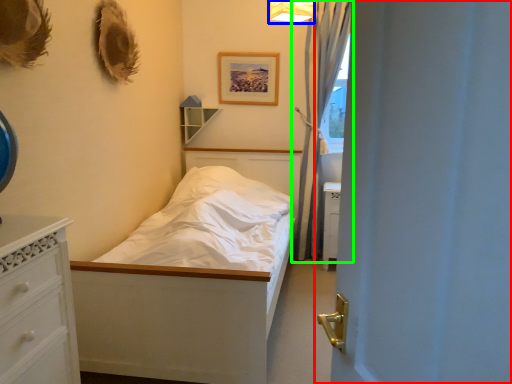
Question: Which is nearer to the door (highlighted by a red box)? light fixture (highlighted by a blue box) or curtain (highlighted by a green box).

Choices:
 (A) light fixture
 (B) curtain

Answer: (A)